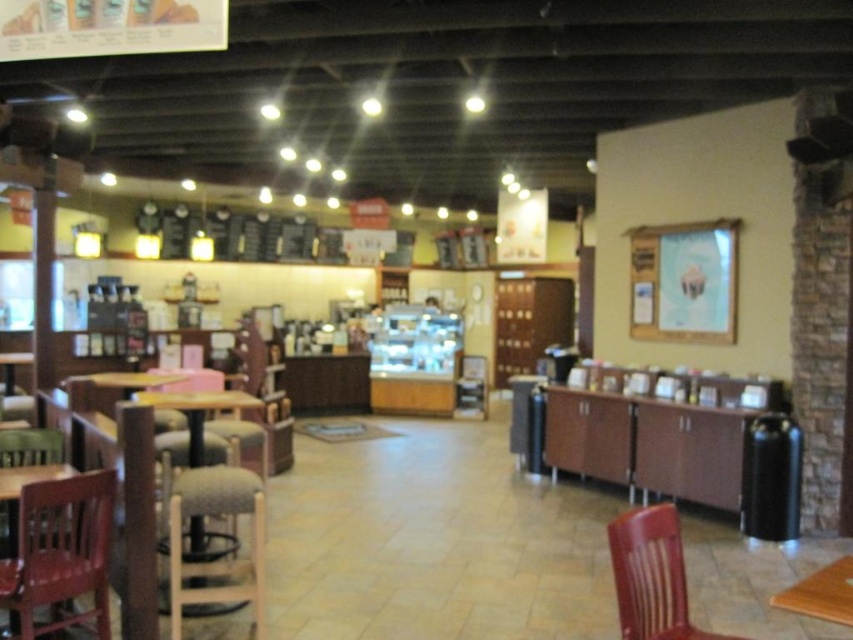
You are sitting at a table in the cafe and want to move to another seat. You see the fabric cushioned bar stool at lower left and the brown wooden chair at lower right. Which seat is closer to the floor?

The fabric cushioned bar stool at lower left is closer to the floor because it is below the brown wooden chair at lower right.

Based on the photo, you are standing at point (190, 404) in the cafe. You want to walk to point (653, 548). Which direction should you move?

You should move forward because point (653, 548) is in front of point (190, 404).